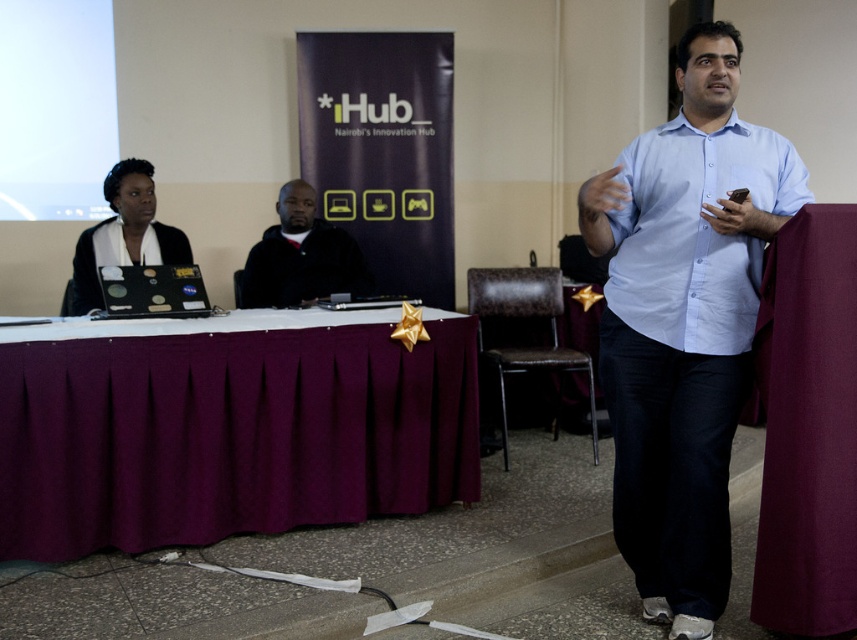
Question: Which of these objects is positioned farthest from the light blue button-down shirt at center?

Choices:
 (A) maroon fabric table at center
 (B) black matte jacket at center
 (C) matte black laptop at left

Answer: (C)

Question: Which point is farther from the camera taking this photo?

Choices:
 (A) (722, 330)
 (B) (321, 256)

Answer: (B)

Question: Which object is farther from the camera taking this photo?

Choices:
 (A) maroon fabric table at center
 (B) black matte jacket at center
 (C) light blue button-down shirt at center

Answer: (B)

Question: Is light blue button-down shirt at center above matte black laptop at left?

Choices:
 (A) no
 (B) yes

Answer: (A)

Question: Can you confirm if maroon fabric table at center is positioned above light blue button-down shirt at center?

Choices:
 (A) no
 (B) yes

Answer: (A)

Question: Does maroon fabric table at center have a smaller size compared to matte black laptop at left?

Choices:
 (A) yes
 (B) no

Answer: (B)